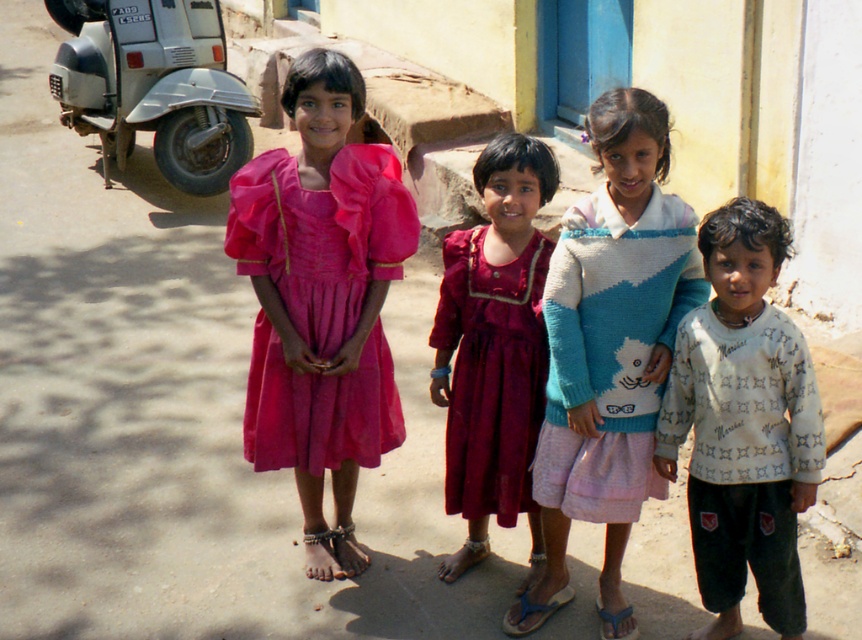
Which of these two, matte pink fabric dress at center or silver metallic scooter at left, stands taller?

silver metallic scooter at left is taller.

Is matte pink fabric dress at center smaller than silver metallic scooter at left?

Indeed, matte pink fabric dress at center has a smaller size compared to silver metallic scooter at left.

Which is behind, point (347, 227) or point (176, 49)?

Positioned behind is point (176, 49).

Locate an element on the screen. This screenshot has height=640, width=862. matte pink fabric dress at center is located at coordinates (322, 236).

Does point (595, 256) come in front of point (541, 394)?

Yes, point (595, 256) is closer to viewer.

Can you confirm if knitted sweater at center is positioned to the right of burgundy satin dress at center?

Yes, knitted sweater at center is to the right of burgundy satin dress at center.

Is point (635, 332) farther from camera compared to point (470, 307)?

No, (635, 332) is in front of (470, 307).

You are a GUI agent. You are given a task and a screenshot of the screen. Output one action in this format:
    pyautogui.click(x=<x>, y=<y>)
    Task: Click on the knitted sweater at center
    The image size is (862, 640).
    Given the screenshot: What is the action you would take?
    pyautogui.click(x=609, y=349)

Consider the image. Does knitted sweater at center appear on the right side of matte pink fabric dress at center?

Yes, knitted sweater at center is to the right of matte pink fabric dress at center.

This screenshot has height=640, width=862. What do you see at coordinates (609, 349) in the screenshot?
I see `knitted sweater at center` at bounding box center [609, 349].

The width and height of the screenshot is (862, 640). In order to click on knitted sweater at center in this screenshot , I will do `click(609, 349)`.